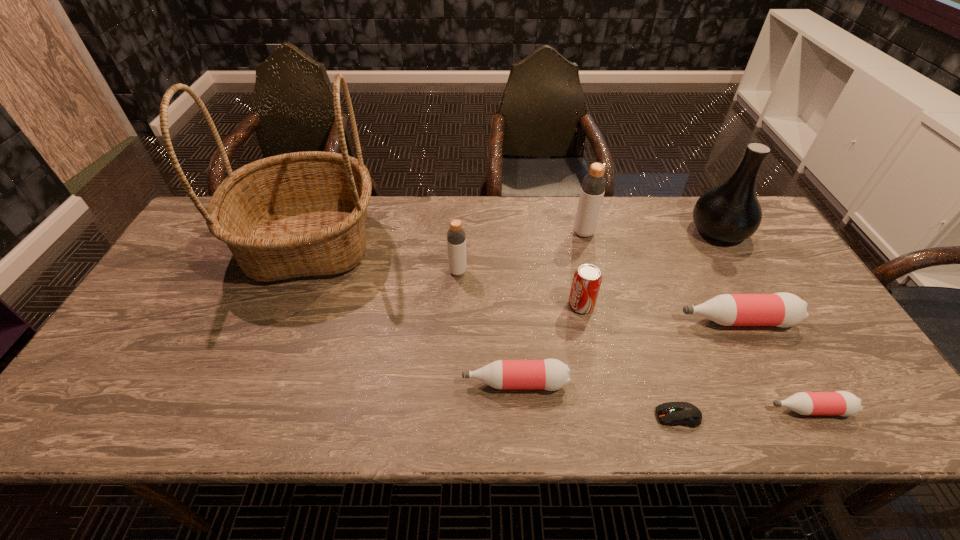
Where is `basket`? The image size is (960, 540). basket is located at coordinates (298, 214).

This screenshot has height=540, width=960. Identify the location of the tallest object. pyautogui.click(x=298, y=214).

At what (x,y) coordinates should I click in order to perform the action: click on the second tallest object. Please return your answer as a coordinate pair (x, y). Looking at the image, I should click on (731, 212).

Image resolution: width=960 pixels, height=540 pixels. Identify the location of the seventh shortest object. (593, 187).

Find the location of a particular element. The width and height of the screenshot is (960, 540). the farthest bottle is located at coordinates (593, 187).

The width and height of the screenshot is (960, 540). What are the coordinates of `the fourth nearest bottle` in the screenshot? It's located at (456, 237).

Locate an element on the screen. This screenshot has width=960, height=540. the fourth shortest bottle is located at coordinates pyautogui.click(x=456, y=237).

At what (x,y) coordinates should I click in order to perform the action: click on the fifth shortest object. Please return your answer as a coordinate pair (x, y). Looking at the image, I should click on (587, 279).

Where is `the farthest pink bottle`? the farthest pink bottle is located at coordinates (782, 309).

Locate an element on the screen. This screenshot has height=540, width=960. the biggest pink bottle is located at coordinates (782, 309).